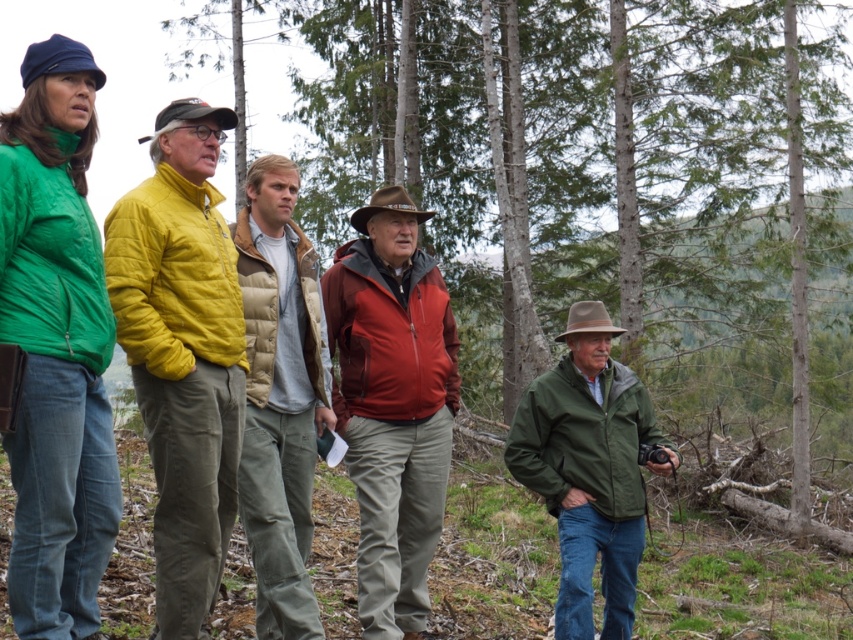
Question: Which object is closer to the camera taking this photo?

Choices:
 (A) yellow quilted jacket at center
 (B) matte red jacket at center

Answer: (A)

Question: Among these points, which one is farthest from the camera?

Choices:
 (A) (33, 147)
 (B) (573, 614)

Answer: (B)

Question: Is matte red jacket at center behind green matte jacket at center?

Choices:
 (A) yes
 (B) no

Answer: (B)

Question: Can you confirm if matte green jacket at left is bigger than yellow quilted jacket at center?

Choices:
 (A) no
 (B) yes

Answer: (A)

Question: Which point appears closest to the camera in this image?

Choices:
 (A) (20, 560)
 (B) (432, 308)

Answer: (A)

Question: Does yellow quilted jacket at center appear under green matte jacket at center?

Choices:
 (A) no
 (B) yes

Answer: (A)